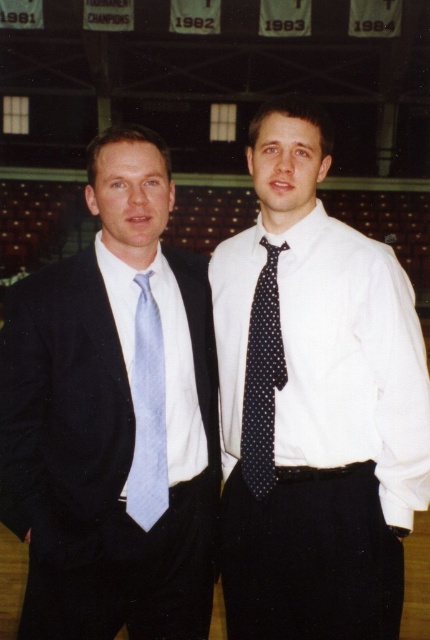
Who is positioned more to the right, white dotted tie at center or matte blue tie at left?

white dotted tie at center

In the scene shown: Who is higher up, white dotted tie at center or matte blue tie at left?

white dotted tie at center is above.

Does point (245, 564) lie behind point (3, 416)?

That is True.

The width and height of the screenshot is (430, 640). Identify the location of white dotted tie at center. (313, 403).

Is white dotted tie at center in front of light blue silk tie at left?

No.

Which is above, white dotted tie at center or light blue silk tie at left?

white dotted tie at center is higher up.

You are a GUI agent. You are given a task and a screenshot of the screen. Output one action in this format:
    pyautogui.click(x=<x>, y=<y>)
    Task: Click on the white dotted tie at center
    The image size is (430, 640).
    Given the screenshot: What is the action you would take?
    pyautogui.click(x=313, y=403)

You are a GUI agent. You are given a task and a screenshot of the screen. Output one action in this format:
    pyautogui.click(x=<x>, y=<y>)
    Task: Click on the white dotted tie at center
    This screenshot has height=640, width=430.
    Given the screenshot: What is the action you would take?
    pyautogui.click(x=313, y=403)

From the picture: Is white dotted tie at center positioned behind black dotted tie at center?

No.

Does point (366, 468) come closer to viewer compared to point (264, 291)?

That is True.

Is point (390, 480) closer to viewer compared to point (245, 454)?

Yes.

At what (x,y) coordinates should I click in order to perform the action: click on white dotted tie at center. Please return your answer as a coordinate pair (x, y). The image size is (430, 640). Looking at the image, I should click on click(x=313, y=403).